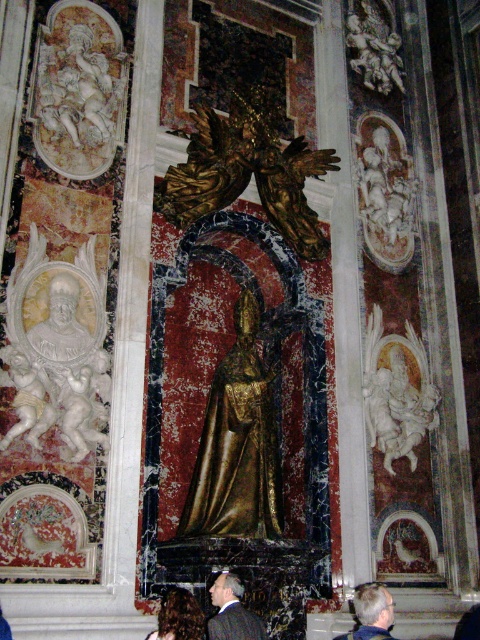
Which is behind, point (215, 513) or point (223, 625)?

Point (215, 513)

Does point (232, 440) lie in front of point (245, 630)?

No, it is behind (245, 630).

The width and height of the screenshot is (480, 640). In order to click on gold polished statue at center in this screenshot , I will do `click(237, 442)`.

Where is `gold polished statue at center`? The image size is (480, 640). gold polished statue at center is located at coordinates (237, 442).

Does gold polished statue at center have a lesser height compared to light brown hair at center?

No.

Which is in front, point (244, 490) or point (358, 614)?

Point (358, 614) is in front.

Identify the location of gold polished statue at center. (237, 442).

Can you confirm if dark suit at center is thinner than light brown hair at center?

Correct, dark suit at center's width is less than light brown hair at center's.

Who is positioned more to the right, dark suit at center or light brown hair at center?

light brown hair at center

Is point (240, 616) more distant than point (387, 632)?

Yes, it is.

Find the location of a particular element. dark suit at center is located at coordinates (231, 611).